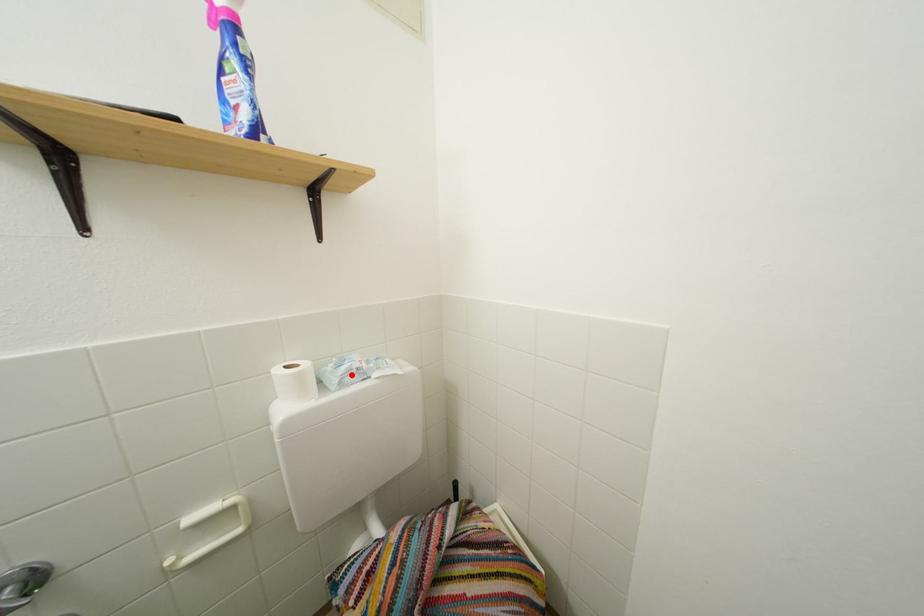
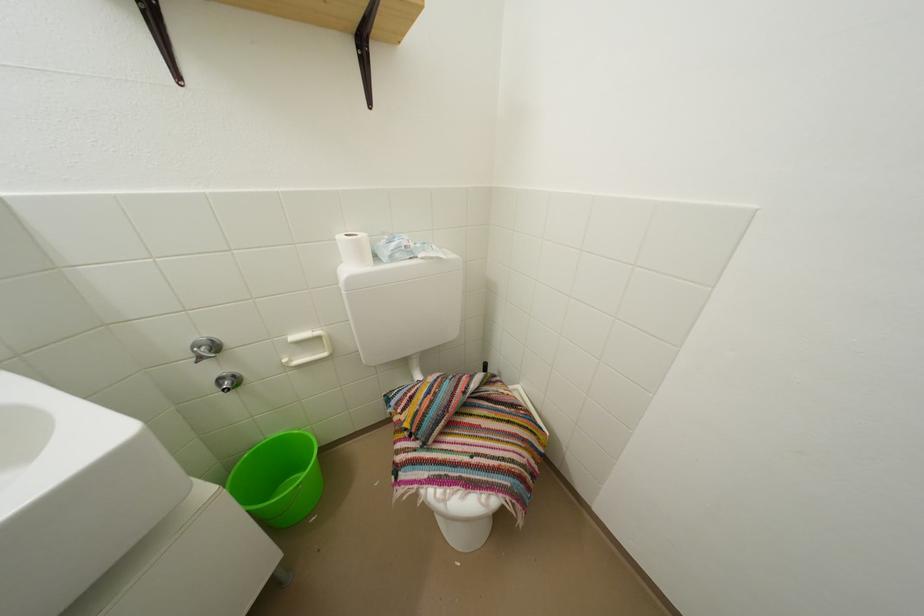
Locate, in the second image, the point that corresponds to the highlighted location in the first image.

(402, 251)